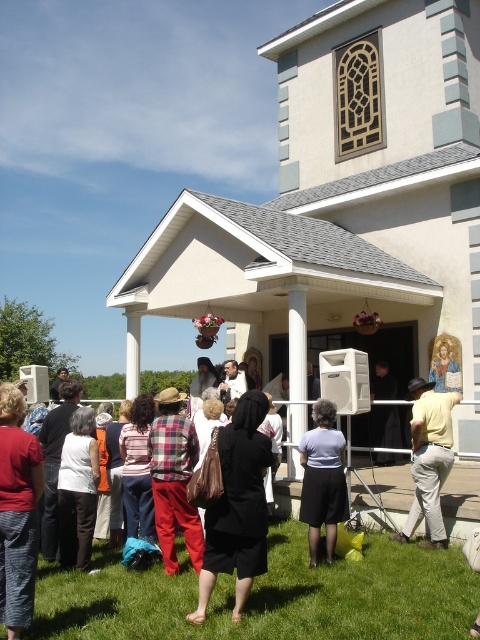
You are organizing a photo shoot and need to ensure that the plaid fabric pants at center and the black fabric at center are both visible in the frame. Given their sizes, which one might you need to position closer to the camera to ensure it stands out more?

The plaid fabric pants at center occupies less space than the black fabric at center, so positioning the plaid fabric pants at center closer to the camera would help it stand out more despite its smaller size.